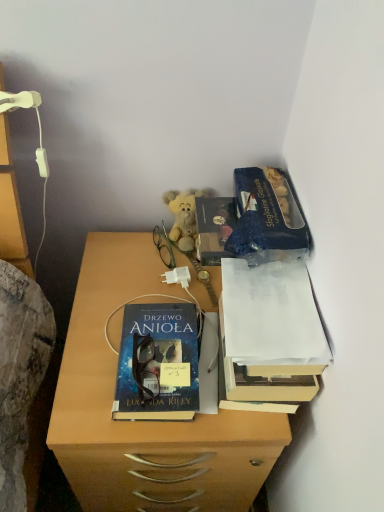
This screenshot has width=384, height=512. What do you see at coordinates (268, 218) in the screenshot? I see `blue matte paper at upper right` at bounding box center [268, 218].

How much space does blue glossy book at center, which is counted as the 2th book, starting from the right, occupy horizontally?

blue glossy book at center, which is counted as the 2th book, starting from the right, is 8.33 inches in width.

Find the location of a particular element. This screenshot has height=512, width=384. green plastic glasses at center is located at coordinates (164, 245).

The height and width of the screenshot is (512, 384). I want to click on white paper at upper right, which ranks as the 1th book in right-to-left order, so click(x=270, y=335).

Where is `soft yellow plush at center`? This screenshot has height=512, width=384. soft yellow plush at center is located at coordinates (184, 217).

Locate an element on the screen. This screenshot has width=384, height=512. blue matte paper at upper right is located at coordinates (268, 218).

From a real-world perspective, is blue matte paper at upper right on top of blue glossy book at center, the first book viewed from the left?

Indeed, from a real-world perspective, blue matte paper at upper right stands above blue glossy book at center, the first book viewed from the left.

Is blue matte paper at upper right not near blue glossy book at center, the first book viewed from the left?

blue matte paper at upper right is actually quite close to blue glossy book at center, the first book viewed from the left.

Between blue matte paper at upper right and blue glossy book at center, the first book viewed from the left, which one has smaller width?

Thinner between the two is blue glossy book at center, the first book viewed from the left.

Is white paper at upper right, which ranks as the 1th book in right-to-left order, looking in the opposite direction of blue glossy book at center, the first book viewed from the left?

No, white paper at upper right, which ranks as the 1th book in right-to-left order, is not facing away from blue glossy book at center, the first book viewed from the left.

How many degrees apart are the facing directions of white paper at upper right, acting as the 2th book starting from the left, and blue glossy book at center, the first book viewed from the left?

There is a 0.586-degree angle between the facing directions of white paper at upper right, acting as the 2th book starting from the left, and blue glossy book at center, the first book viewed from the left.

Is white paper at upper right, acting as the 2th book starting from the left, not inside blue glossy book at center, the first book viewed from the left?

Yes, white paper at upper right, acting as the 2th book starting from the left, is not within blue glossy book at center, the first book viewed from the left.

Is matte wooden desk at center at the back of white paper at upper right, which ranks as the 1th book in right-to-left order?

No, white paper at upper right, which ranks as the 1th book in right-to-left order, is not facing away from matte wooden desk at center.

From a real-world perspective, is white paper at upper right, acting as the 2th book starting from the left, beneath matte wooden desk at center?

Actually, white paper at upper right, acting as the 2th book starting from the left, is physically above matte wooden desk at center in the real world.

Is white paper at upper right, which ranks as the 1th book in right-to-left order, placed right next to matte wooden desk at center?

No, white paper at upper right, which ranks as the 1th book in right-to-left order, is not beside matte wooden desk at center.

Looking at this image, is white paper at upper right, acting as the 2th book starting from the left, looking in the opposite direction of blue matte paper at upper right?

No, white paper at upper right, acting as the 2th book starting from the left, is not facing the opposite direction of blue matte paper at upper right.

Considering the relative sizes of white paper at upper right, which ranks as the 1th book in right-to-left order, and blue matte paper at upper right in the image provided, is white paper at upper right, which ranks as the 1th book in right-to-left order, bigger than blue matte paper at upper right?

Indeed, white paper at upper right, which ranks as the 1th book in right-to-left order, has a larger size compared to blue matte paper at upper right.

Is white paper at upper right, acting as the 2th book starting from the left, further to the viewer compared to blue matte paper at upper right?

No, it is in front of blue matte paper at upper right.

Is blue glossy book at center, which is counted as the 2th book, starting from the right, taller or shorter than white paper at upper right, acting as the 2th book starting from the left?

blue glossy book at center, which is counted as the 2th book, starting from the right, is taller than white paper at upper right, acting as the 2th book starting from the left.

Could you tell me if blue glossy book at center, which is counted as the 2th book, starting from the right, is facing white paper at upper right, acting as the 2th book starting from the left?

No, blue glossy book at center, which is counted as the 2th book, starting from the right, is not aimed at white paper at upper right, acting as the 2th book starting from the left.

Are blue glossy book at center, the first book viewed from the left, and white paper at upper right, acting as the 2th book starting from the left, located far from each other?

No, blue glossy book at center, the first book viewed from the left, is in close proximity to white paper at upper right, acting as the 2th book starting from the left.

Can you tell me how much blue glossy book at center, which is counted as the 2th book, starting from the right, and white paper at upper right, acting as the 2th book starting from the left, differ in facing direction?

0.586 degrees separate the facing orientations of blue glossy book at center, which is counted as the 2th book, starting from the right, and white paper at upper right, acting as the 2th book starting from the left.

Considering the positions of point (175, 203) and point (254, 254), is point (175, 203) closer or farther from the camera than point (254, 254)?

Clearly, point (175, 203) is more distant from the camera than point (254, 254).

From a real-world perspective, is soft yellow plush at center located higher than blue matte paper at upper right?

Incorrect, from a real-world perspective, soft yellow plush at center is lower than blue matte paper at upper right.

Between soft yellow plush at center and blue matte paper at upper right, which one has larger width?

With larger width is blue matte paper at upper right.

Looking at the image, does white paper at upper right, acting as the 2th book starting from the left, seem bigger or smaller compared to green plastic glasses at center?

white paper at upper right, acting as the 2th book starting from the left, is bigger than green plastic glasses at center.

Considering the positions of objects white paper at upper right, which ranks as the 1th book in right-to-left order, and green plastic glasses at center in the image provided, who is more to the right, white paper at upper right, which ranks as the 1th book in right-to-left order, or green plastic glasses at center?

From the viewer's perspective, white paper at upper right, which ranks as the 1th book in right-to-left order, appears more on the right side.

Consider the image. Does white paper at upper right, acting as the 2th book starting from the left, contain green plastic glasses at center?

Definitely not — green plastic glasses at center is not inside white paper at upper right, acting as the 2th book starting from the left.

Is white paper at upper right, which ranks as the 1th book in right-to-left order, in contact with green plastic glasses at center?

There is a gap between white paper at upper right, which ranks as the 1th book in right-to-left order, and green plastic glasses at center.

Which book is the 2nd one when counting from the front of the blue matte paper at upper right? Please provide its 2D coordinates.

[(157, 362)]

I want to click on book beneath the white paper at upper right, which ranks as the 1th book in right-to-left order (from a real-world perspective), so click(157, 362).

Based on their spatial positions, is blue glossy book at center, the first book viewed from the left, or matte wooden desk at center further from green plastic glasses at center?

matte wooden desk at center is further to green plastic glasses at center.

From the image, which object appears to be farther from green plastic glasses at center, soft yellow plush at center or blue glossy book at center, which is counted as the 2th book, starting from the right?

The object further to green plastic glasses at center is blue glossy book at center, which is counted as the 2th book, starting from the right.

Which object lies further to the anchor point blue matte paper at upper right, soft yellow plush at center or green plastic glasses at center?

green plastic glasses at center.

Which object lies further to the anchor point white paper at upper right, which ranks as the 1th book in right-to-left order, blue glossy book at center, the first book viewed from the left, or soft yellow plush at center?

soft yellow plush at center lies further to white paper at upper right, which ranks as the 1th book in right-to-left order, than the other object.

Consider the image. When comparing their distances from soft yellow plush at center, does blue matte paper at upper right or matte wooden desk at center seem further?

Based on the image, matte wooden desk at center appears to be further to soft yellow plush at center.

Considering their positions, is green plastic glasses at center positioned further to blue glossy book at center, which is counted as the 2th book, starting from the right, than matte wooden desk at center?

green plastic glasses at center is further to blue glossy book at center, which is counted as the 2th book, starting from the right.

When comparing their distances from blue glossy book at center, the first book viewed from the left, does blue matte paper at upper right or matte wooden desk at center seem further?

Based on the image, blue matte paper at upper right appears to be further to blue glossy book at center, the first book viewed from the left.

Based on their spatial positions, is white paper at upper right, which ranks as the 1th book in right-to-left order, or blue matte paper at upper right closer to soft yellow plush at center?

Among the two, blue matte paper at upper right is located nearer to soft yellow plush at center.

I want to click on book that lies between blue matte paper at upper right and blue glossy book at center, which is counted as the 2th book, starting from the right, from top to bottom, so click(x=270, y=335).

Identify the location of teddy bear that lies between blue matte paper at upper right and blue glossy book at center, which is counted as the 2th book, starting from the right, from top to bottom. This screenshot has height=512, width=384. (184, 217).

The width and height of the screenshot is (384, 512). I want to click on teddy bear between green plastic glasses at center and blue matte paper at upper right, so click(184, 217).

Locate an element on the screen. Image resolution: width=384 pixels, height=512 pixels. teddy bear between white paper at upper right, acting as the 2th book starting from the left, and green plastic glasses at center in the front-back direction is located at coordinates (184, 217).